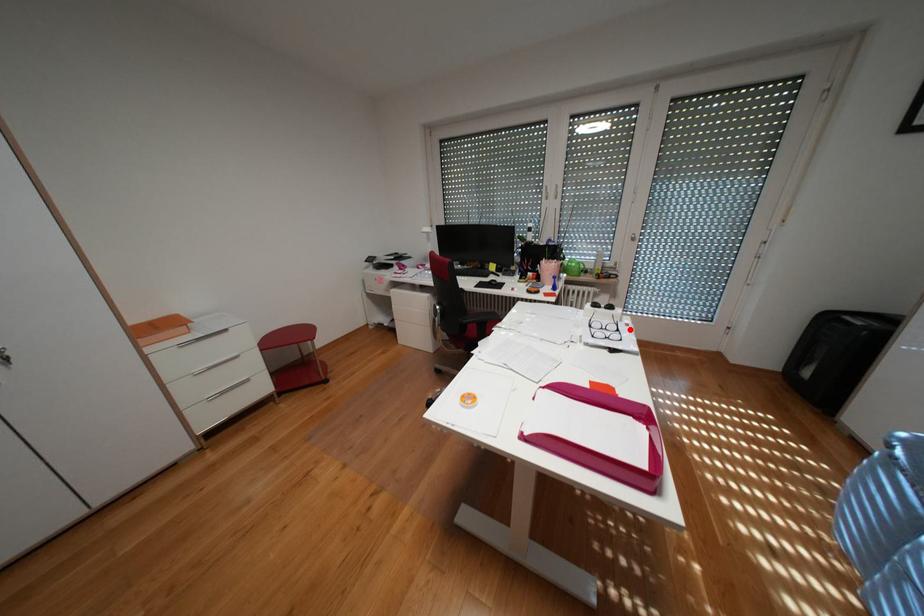
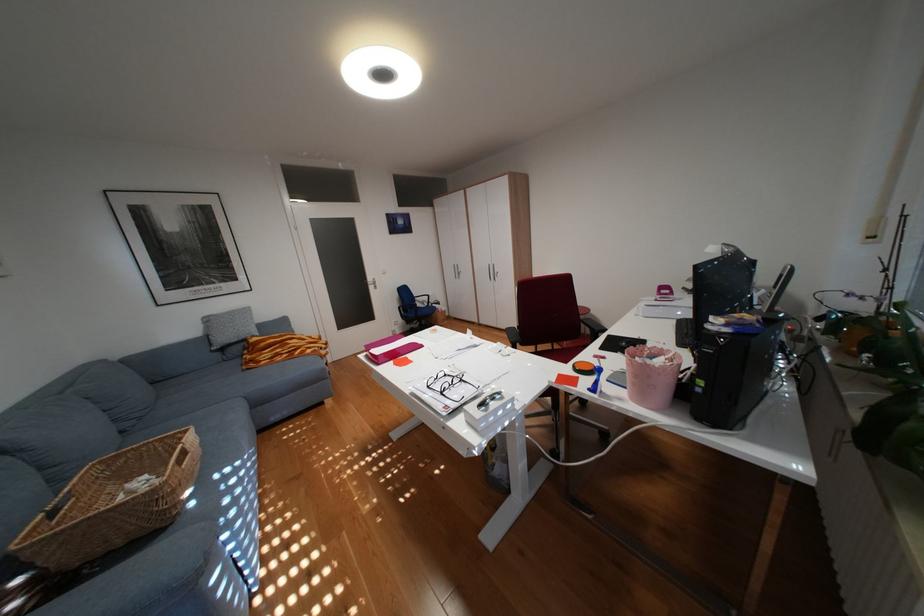
In the second image, find the point that corresponds to the highlighted location in the first image.

(454, 392)